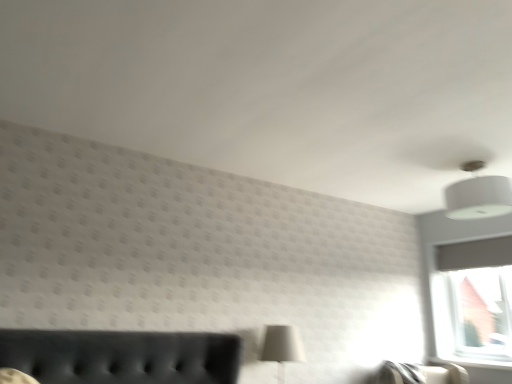
Question: Is white glossy window sill at lower right in front of or behind white matte table lamp at lower center in the image?

Choices:
 (A) behind
 (B) front

Answer: (A)

Question: Considering the positions of white glossy window sill at lower right and white matte table lamp at lower center in the image, is white glossy window sill at lower right taller or shorter than white matte table lamp at lower center?

Choices:
 (A) tall
 (B) short

Answer: (B)

Question: Which object is positioned farthest from the white matte table lamp at lower center?

Choices:
 (A) white fabric lampshade at upper right
 (B) white glossy window sill at lower right

Answer: (B)

Question: Estimate the real-world distances between objects in this image. Which object is closer to the white matte table lamp at lower center?

Choices:
 (A) white glossy window sill at lower right
 (B) white fabric lampshade at upper right

Answer: (B)